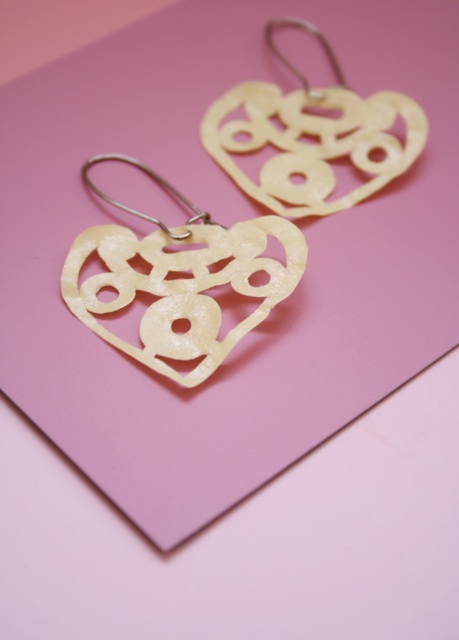
Who is more forward, (80,241) or (303,164)?

Point (80,241) is in front.

Is ivory matte heart at center to the right of ivory matte heart-shaped earring at upper center from the viewer's perspective?

No, ivory matte heart at center is not to the right of ivory matte heart-shaped earring at upper center.

Where is `ivory matte heart at center`? The image size is (459, 640). ivory matte heart at center is located at coordinates click(179, 280).

The height and width of the screenshot is (640, 459). What do you see at coordinates (312, 134) in the screenshot? I see `ivory matte heart-shaped earring at upper center` at bounding box center [312, 134].

Who is higher up, ivory matte heart-shaped earring at upper center or polished metal hook at upper left?

ivory matte heart-shaped earring at upper center is higher up.

Describe the element at coordinates (312, 134) in the screenshot. This screenshot has width=459, height=640. I see `ivory matte heart-shaped earring at upper center` at that location.

The width and height of the screenshot is (459, 640). I want to click on ivory matte heart-shaped earring at upper center, so point(312,134).

Can you confirm if ivory matte heart at center is shorter than polished metal hook at upper left?

In fact, ivory matte heart at center may be taller than polished metal hook at upper left.

Can you confirm if ivory matte heart at center is bigger than polished metal hook at upper left?

Yes, ivory matte heart at center is bigger than polished metal hook at upper left.

Is point (102, 237) closer to viewer compared to point (162, 225)?

Yes, it is in front of point (162, 225).

Locate an element on the screen. The image size is (459, 640). ivory matte heart at center is located at coordinates (179, 280).